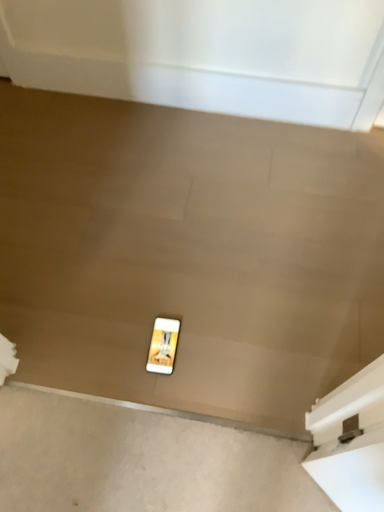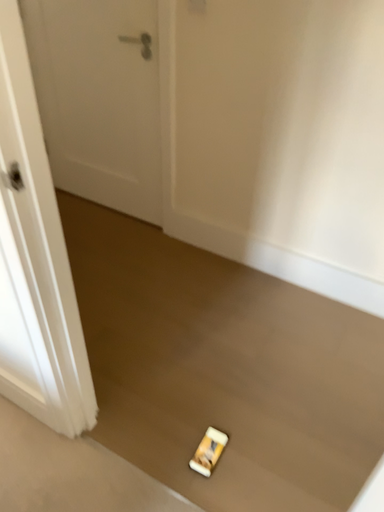
Question: Which way did the camera rotate in the video?

Choices:
 (A) rotated right
 (B) rotated left

Answer: (B)